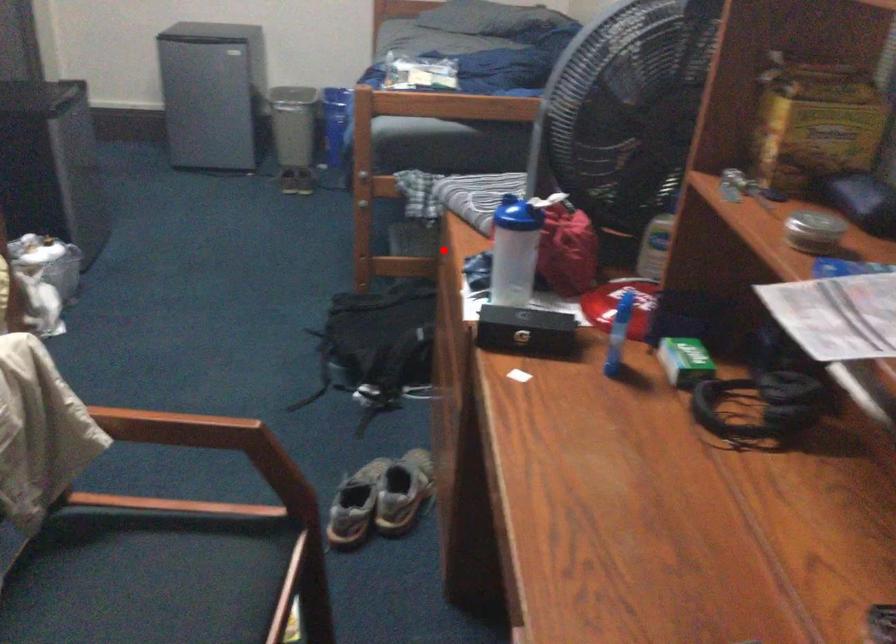
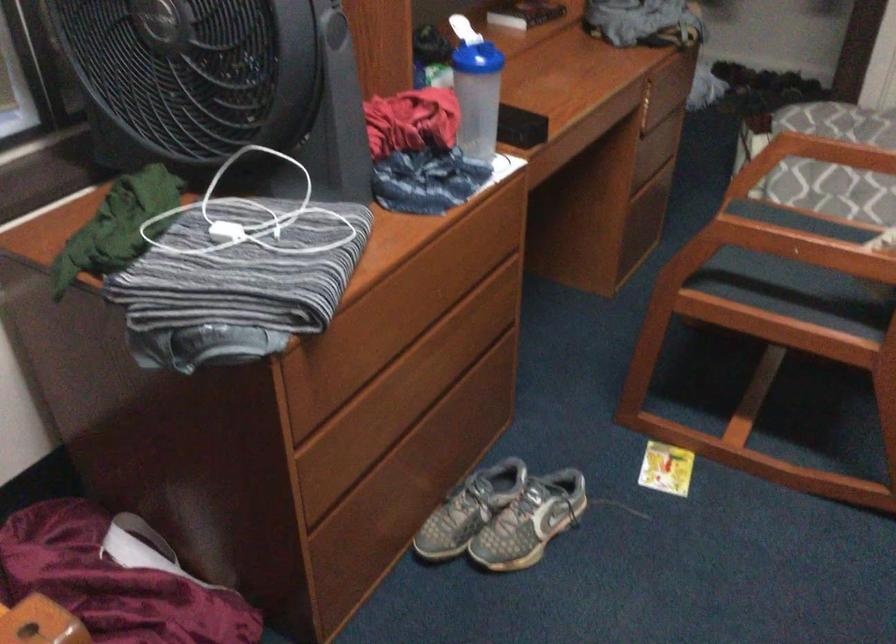
In the second image, find the point that corresponds to the highlighted location in the first image.

(312, 415)